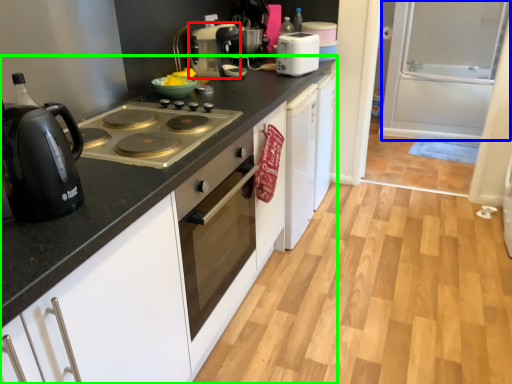
Question: Which object is positioned farthest from kitchen appliance (highlighted by a red box)? Select from screen door (highlighted by a blue box) and countertop (highlighted by a green box).

Choices:
 (A) screen door
 (B) countertop

Answer: (A)